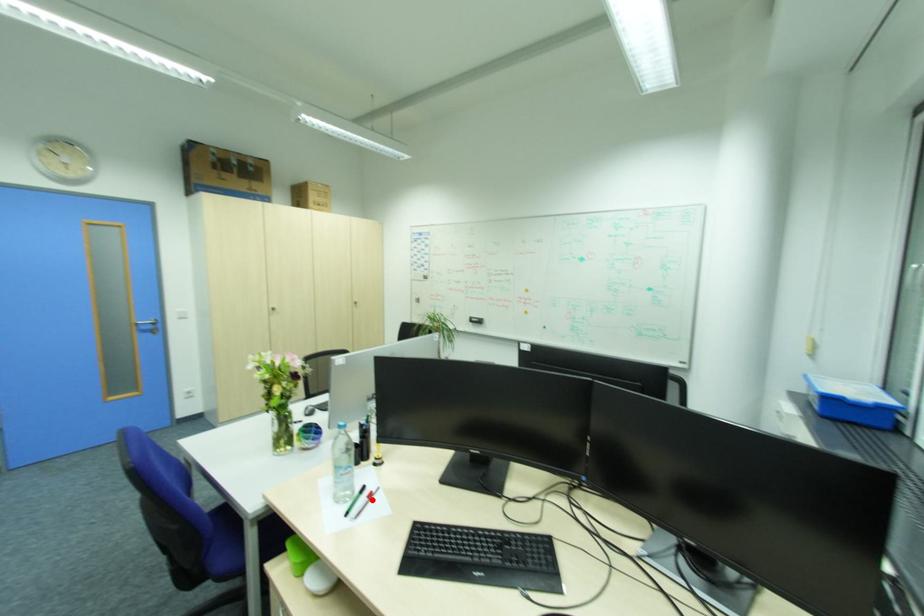
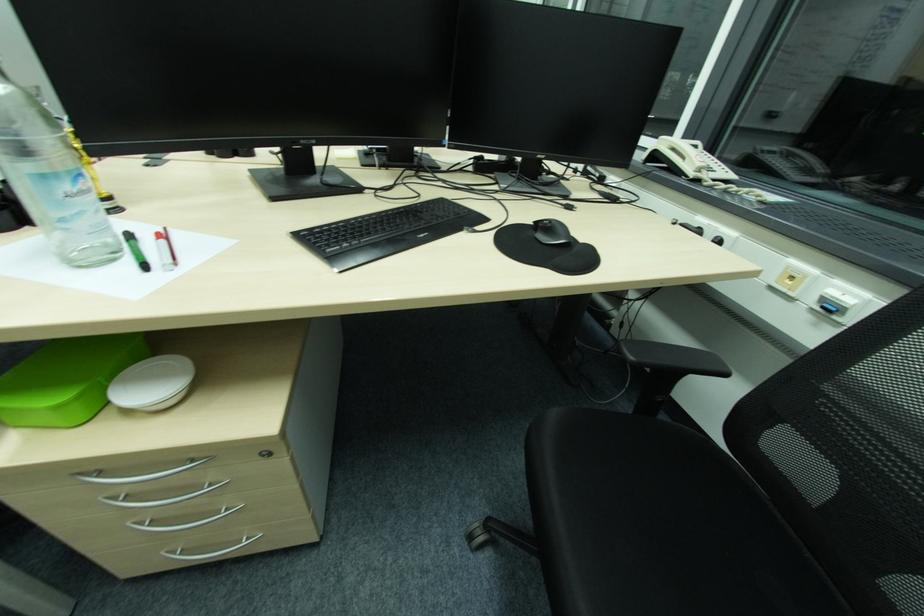
Where in the second image is the point corresponding to the highlighted location from the first image?

(167, 241)